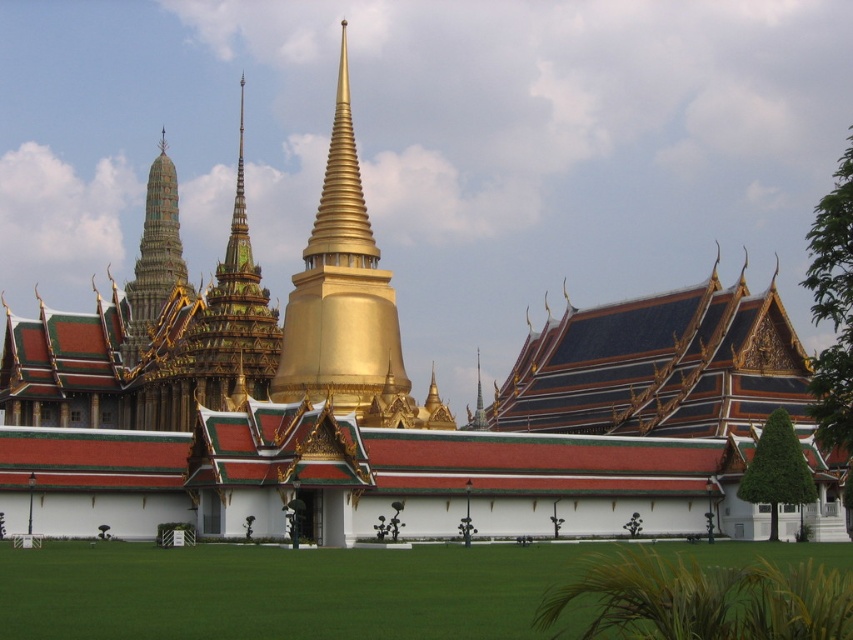
Question: Is gold polished spire at center to the left of green textured spire at upper left from the viewer's perspective?

Choices:
 (A) no
 (B) yes

Answer: (A)

Question: Among these objects, which one is nearest to the camera?

Choices:
 (A) gold polished spire at center
 (B) green textured spire at upper left

Answer: (A)

Question: Can you confirm if gold polished spire at center is wider than green textured spire at upper left?

Choices:
 (A) no
 (B) yes

Answer: (B)

Question: Does gold polished spire at center come behind green textured spire at upper left?

Choices:
 (A) no
 (B) yes

Answer: (A)